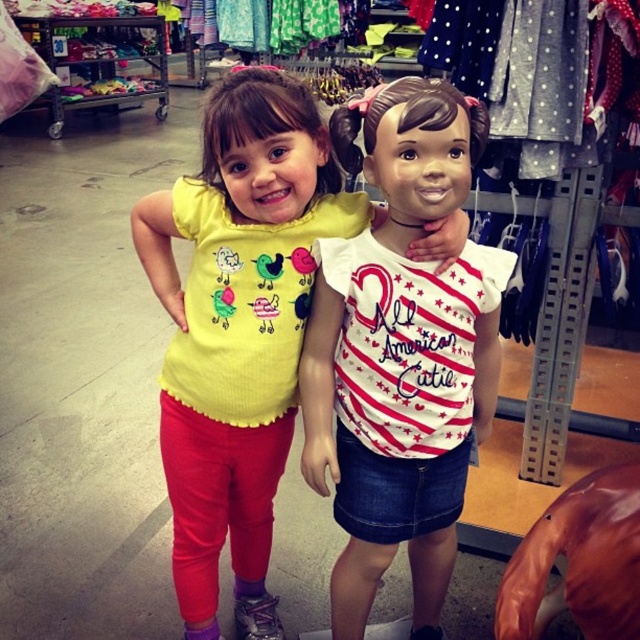
Which is more to the right, yellow matte shirt at center or white matte shirt at center?

white matte shirt at center

Can you confirm if yellow matte shirt at center is positioned below white matte shirt at center?

No, yellow matte shirt at center is not below white matte shirt at center.

The image size is (640, 640). Identify the location of yellow matte shirt at center. 237,328.

Find the location of `yellow matte shirt at center`. yellow matte shirt at center is located at coordinates (237, 328).